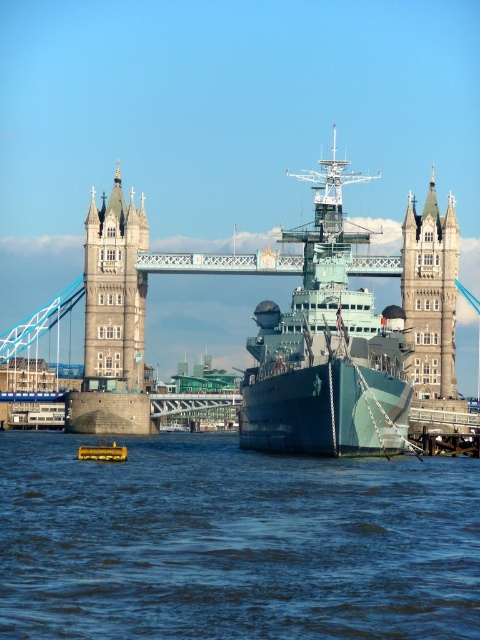
Does stone tower at left have a lesser height compared to stone tower at center?

No, stone tower at left is not shorter than stone tower at center.

Find the location of `stone tower at left`. stone tower at left is located at coordinates (112, 321).

Which is above, stone tower at left or yellow rubber boat at lower center?

stone tower at left is above.

Find the location of a particular element. Image resolution: width=480 pixels, height=640 pixels. stone tower at left is located at coordinates [112, 321].

In the scene shown: Between stone tower at center and yellow rubber boat at lower center, which one is positioned lower?

yellow rubber boat at lower center

Does stone tower at center lie in front of yellow rubber boat at lower center?

No, stone tower at center is further to the viewer.

What do you see at coordinates (430, 294) in the screenshot? I see `stone tower at center` at bounding box center [430, 294].

Locate an element on the screen. The width and height of the screenshot is (480, 640). stone tower at center is located at coordinates (430, 294).